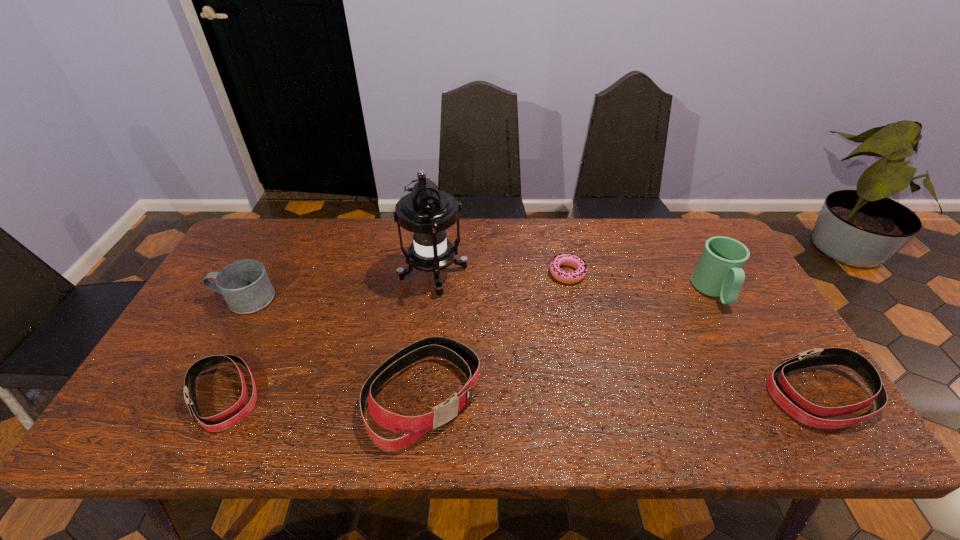
You are a GUI agent. You are given a task and a screenshot of the screen. Output one action in this format:
    pyautogui.click(x=<x>, y=<y>)
    Task: Click on the object identified as the fifth closest to the tallest dog collar
    The image size is (960, 540).
    Given the screenshot: What is the action you would take?
    pyautogui.click(x=719, y=273)

You are a GUI agent. You are given a task and a screenshot of the screen. Output one action in this format:
    pyautogui.click(x=<x>, y=<y>)
    Task: Click on the sixth closest object relative to the rightmost dog collar
    This screenshot has width=960, height=540.
    Given the screenshot: What is the action you would take?
    pyautogui.click(x=245, y=286)

The image size is (960, 540). I want to click on dog collar that stands as the closest to the rightmost dog collar, so click(x=414, y=427).

Identify which dog collar is located as the third nearest to the left mug. Please provide its 2D coordinates. Your answer should be formatted as a tuple, i.e. [(x, y)], where the tuple contains the x and y coordinates of a point satisfying the conditions above.

[(787, 398)]

The image size is (960, 540). In order to click on free point that satisfies the following two spatial constraints: 1. on the side of the taller mug with the handle; 2. on the side of the left mug with the handle in this screenshot , I will do `click(718, 299)`.

Image resolution: width=960 pixels, height=540 pixels. Find the location of `vacant space that satisfies the following two spatial constraints: 1. on the front side of the rightmost dog collar; 2. on the right side of the lantern`. vacant space that satisfies the following two spatial constraints: 1. on the front side of the rightmost dog collar; 2. on the right side of the lantern is located at coordinates (420, 394).

The image size is (960, 540). Find the location of `free space that satisfies the following two spatial constraints: 1. on the side of the rightmost dog collar with the handle; 2. on the left side of the right mug`. free space that satisfies the following two spatial constraints: 1. on the side of the rightmost dog collar with the handle; 2. on the left side of the right mug is located at coordinates point(770,394).